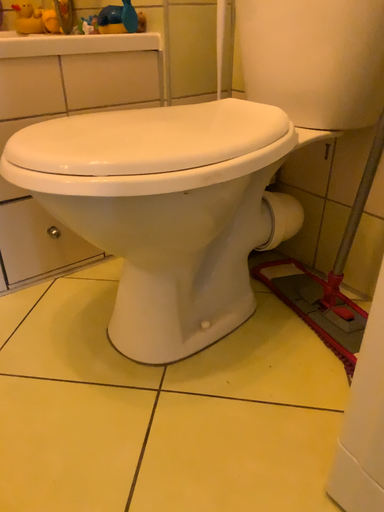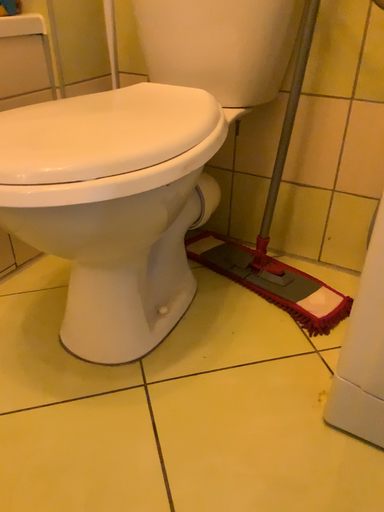
Question: How did the camera likely rotate when shooting the video?

Choices:
 (A) rotated left
 (B) rotated right

Answer: (B)